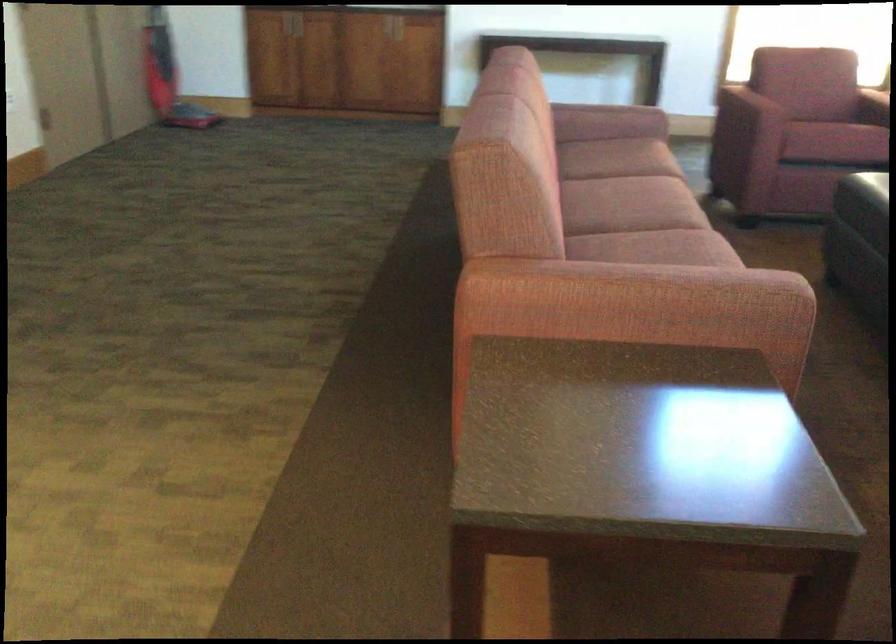
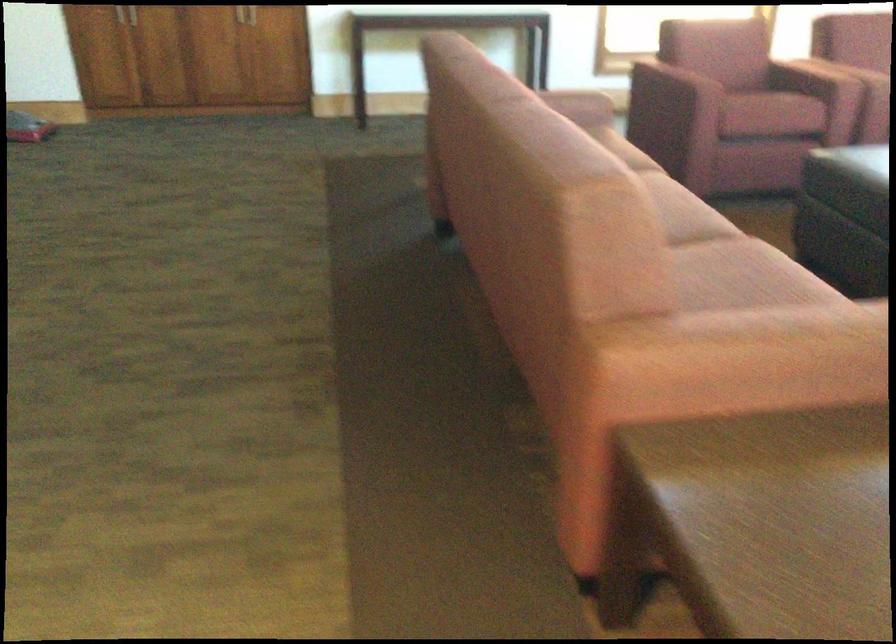
In a continuous first-person perspective shot, in which direction is the camera moving?

The cameraman walked toward left, forward.